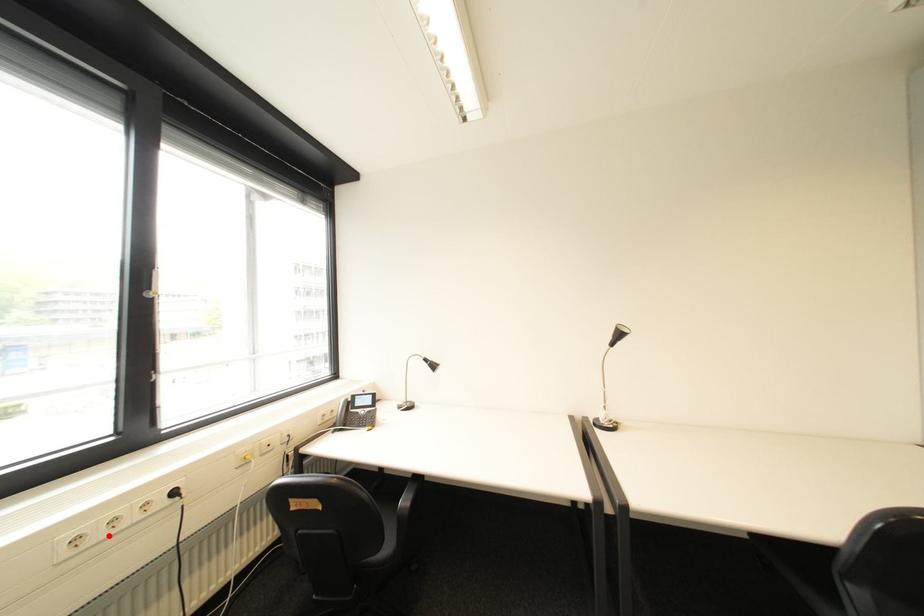
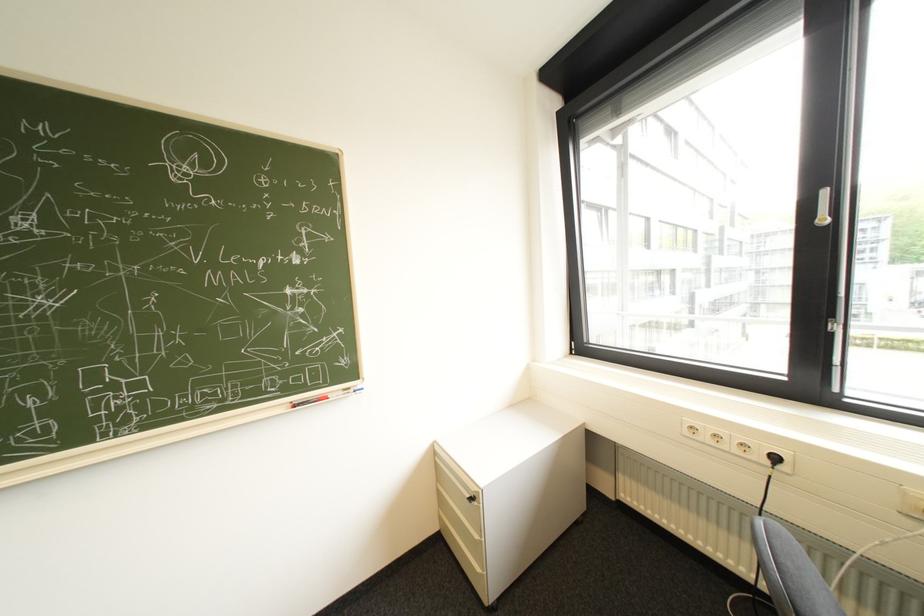
Find the pixel in the second image that matches the highlighted location in the first image.

(715, 438)